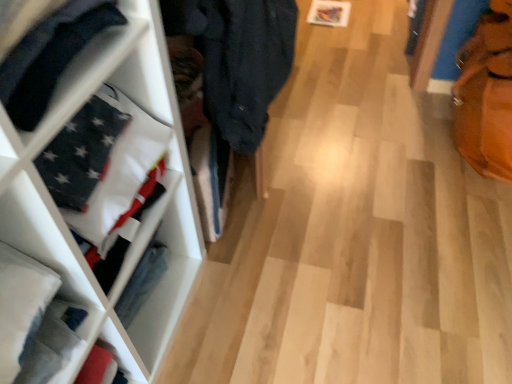
Question: Visually, is white fabric at left positioned to the left or to the right of matte black flag at left?

Choices:
 (A) left
 (B) right

Answer: (B)

Question: Is white fabric at left in front of or behind matte black flag at left in the image?

Choices:
 (A) behind
 (B) front

Answer: (A)

Question: Estimate the real-world distances between objects in this image. Which object is closer to the white fabric at left?

Choices:
 (A) matte black flag at left
 (B) leather textured tote bag at right

Answer: (A)

Question: Which of these objects is positioned closest to the leather textured tote bag at right?

Choices:
 (A) matte black flag at left
 (B) white fabric at left

Answer: (B)